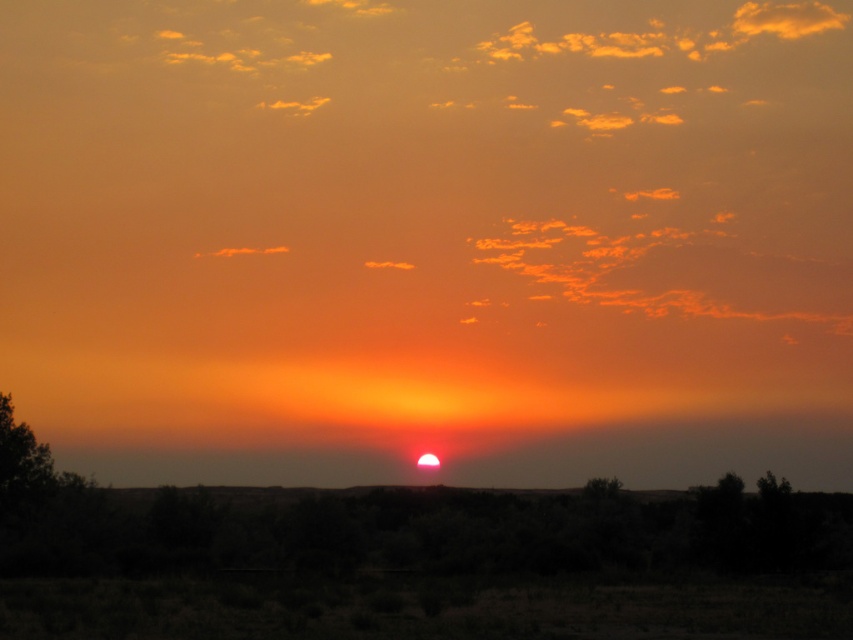
Does point (782, 497) come behind point (587, 486)?

No, (782, 497) is closer to viewer.

Which is in front, point (782, 477) or point (596, 480)?

Point (782, 477)

Is point (769, 470) farther from viewer compared to point (605, 481)?

That is False.

Where is `green leafy tree at center`? This screenshot has width=853, height=640. green leafy tree at center is located at coordinates 773,488.